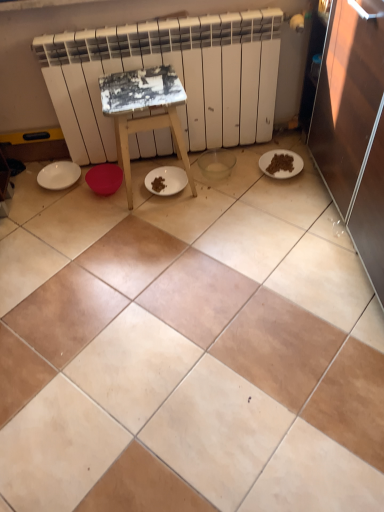
Find the location of a particular element. The width and height of the screenshot is (384, 512). free space on the front side of white matte radiator at upper center is located at coordinates (190, 247).